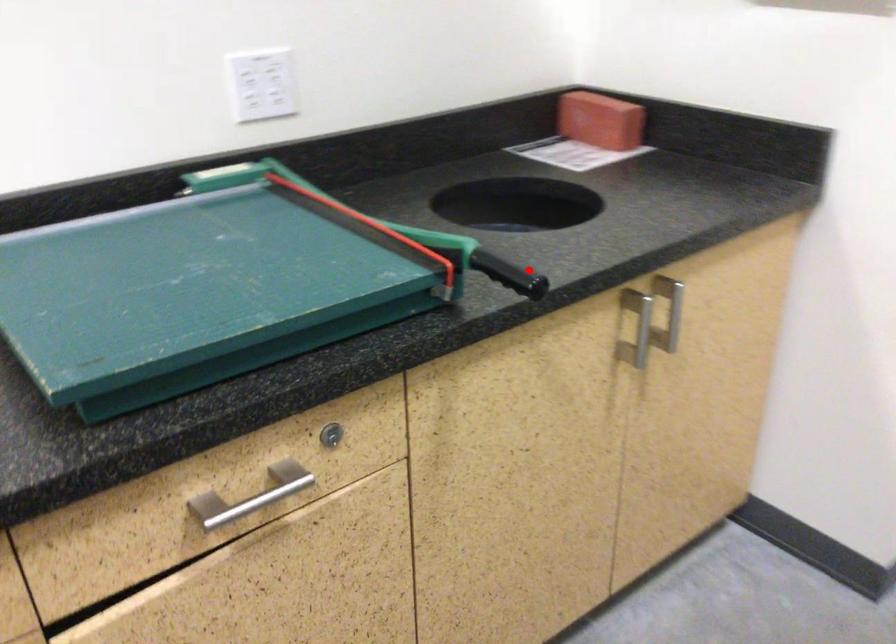
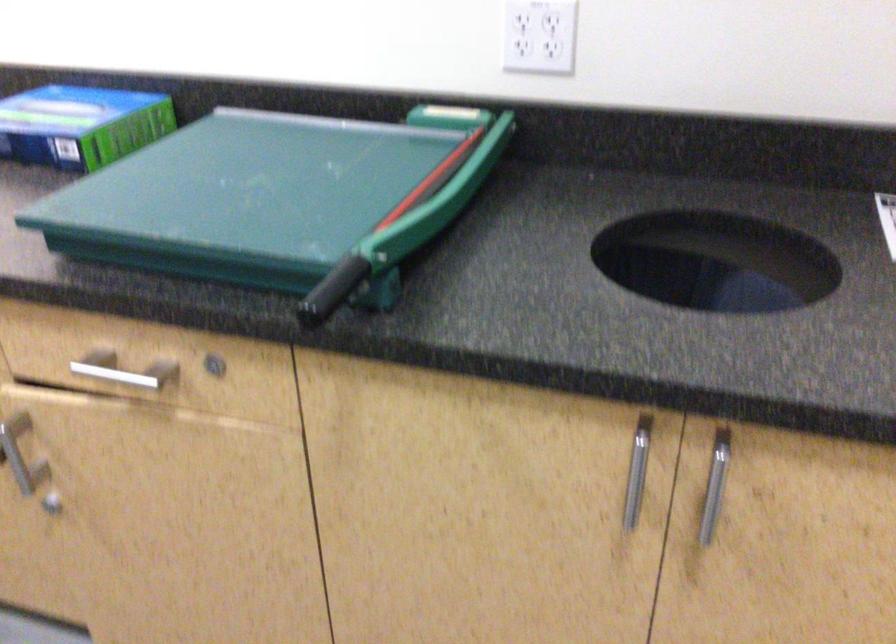
Question: I am providing you with two images of the same scene from different viewpoints. Image1 has a red point marked. In image2, the corresponding 3D location appears at what relative position? Reply with the corresponding letter.

Choices:
 (A) Closer
 (B) Farther

Answer: (A)